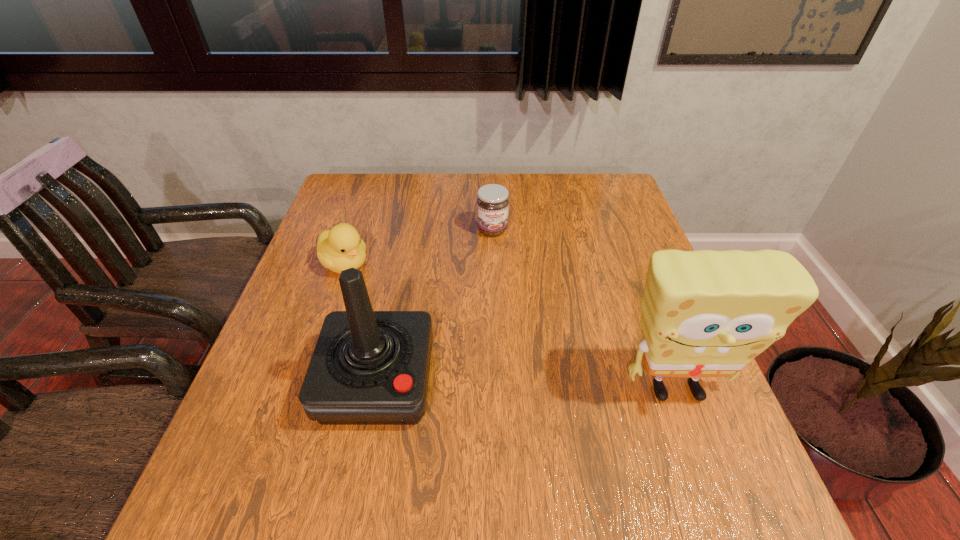
Where is `free space located on the front-facing side of the second farthest object`? The image size is (960, 540). free space located on the front-facing side of the second farthest object is located at coordinates (452, 337).

Where is `free location located on the front-facing side of the second farthest object`? This screenshot has height=540, width=960. free location located on the front-facing side of the second farthest object is located at coordinates (469, 349).

Find the location of a particular element. The height and width of the screenshot is (540, 960). joystick that is at the near edge is located at coordinates (368, 367).

What are the coordinates of `sponge that is at the near edge` in the screenshot? It's located at (704, 313).

Identify the location of joystick present at the left edge. The image size is (960, 540). (368, 367).

Find the location of `duck positioned at the left edge`. duck positioned at the left edge is located at coordinates (338, 249).

You are a GUI agent. You are given a task and a screenshot of the screen. Output one action in this format:
    pyautogui.click(x=<x>, y=<y>)
    Task: Click on the object situated at the right edge
    
    Given the screenshot: What is the action you would take?
    pyautogui.click(x=704, y=313)

This screenshot has height=540, width=960. I want to click on object that is at the near left corner, so click(x=368, y=367).

Identify the location of object that is at the near right corner. The image size is (960, 540). (704, 313).

At what (x,y) coordinates should I click in order to perform the action: click on blank space at the far edge of the desktop. Please return your answer as a coordinate pair (x, y). This screenshot has width=960, height=540. Looking at the image, I should click on (557, 208).